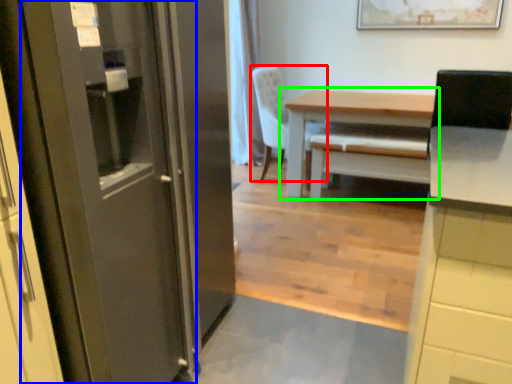
Question: Based on their relative distances, which object is nearer to chair (highlighted by a red box)? Choose from door (highlighted by a blue box) and table (highlighted by a green box).

Choices:
 (A) door
 (B) table

Answer: (B)